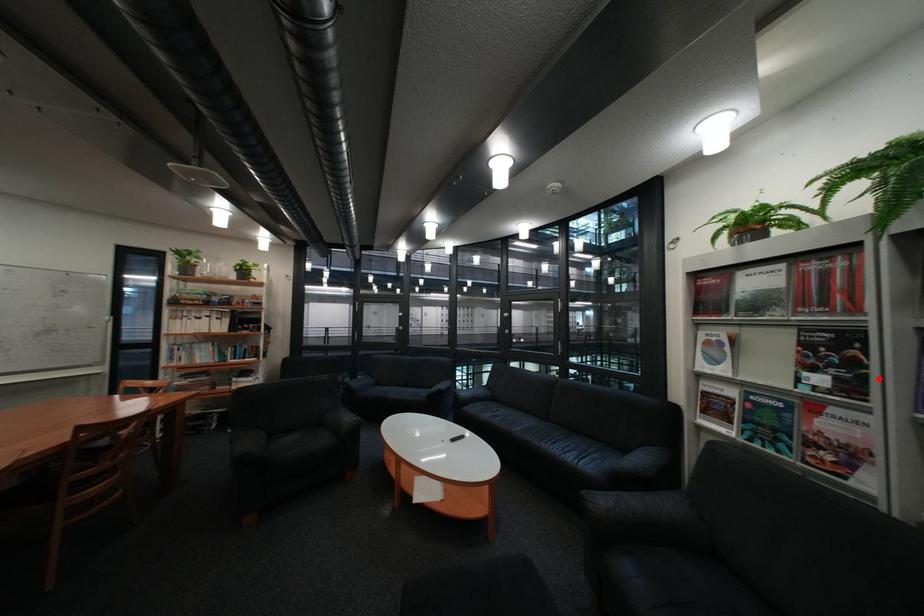
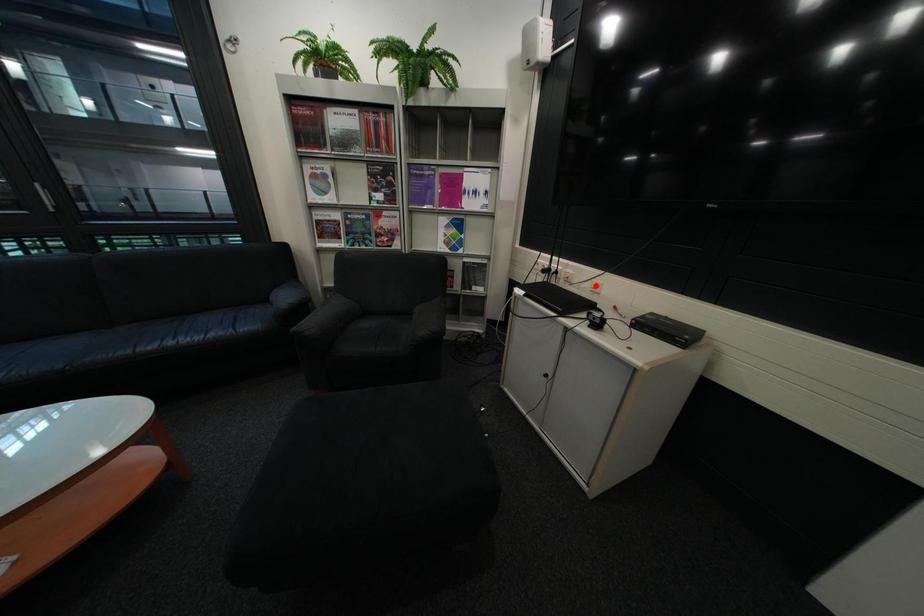
I am providing you with two images of the same scene from different viewpoints. A red point is marked on the first image and another point is marked on the second image. Does the point marked in image1 correspond to the same location as the one in image2?

No